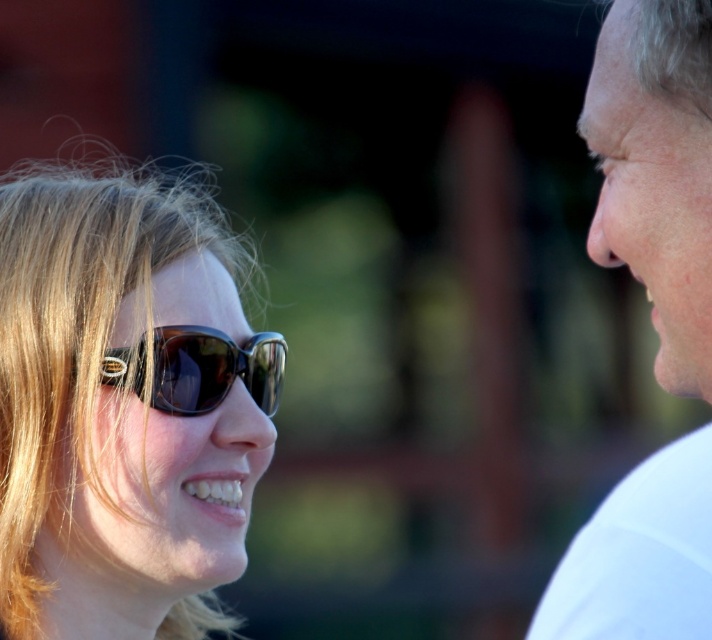
You are a photographer trying to capture a close shot of the woman with light brown hair and sunglasses. The point you need to focus on is point (587, 609). If your camera has a minimum focusing distance of 28 inches, will you be able to take the photo clearly?

The point (587, 609) and the camera are 28.27 inches apart. Since the minimum focusing distance is 28 inches, the camera can focus on the point as it is slightly beyond the required distance, allowing for a clear photo.

You are a photographer adjusting the focus on your camera. You need to ensure that both the matte brown sunglasses at left and the person on the right are in focus. Given their positions, can you confirm if they are within the same focal plane?

The matte brown sunglasses at left is located at point (125,406), so the person on the right is not mentioned in the objects description, but since the question mentions both, the answer should state that the sunglasses are at that coordinate, but the position of the person on the right isn